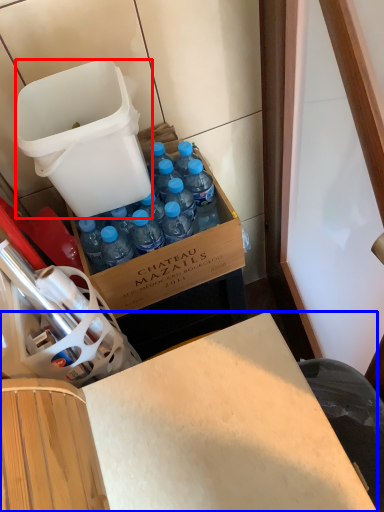
Question: Among these objects, which one is farthest to the camera, trash bin/can (highlighted by a red box) or desk (highlighted by a blue box)?

Choices:
 (A) trash bin/can
 (B) desk

Answer: (A)